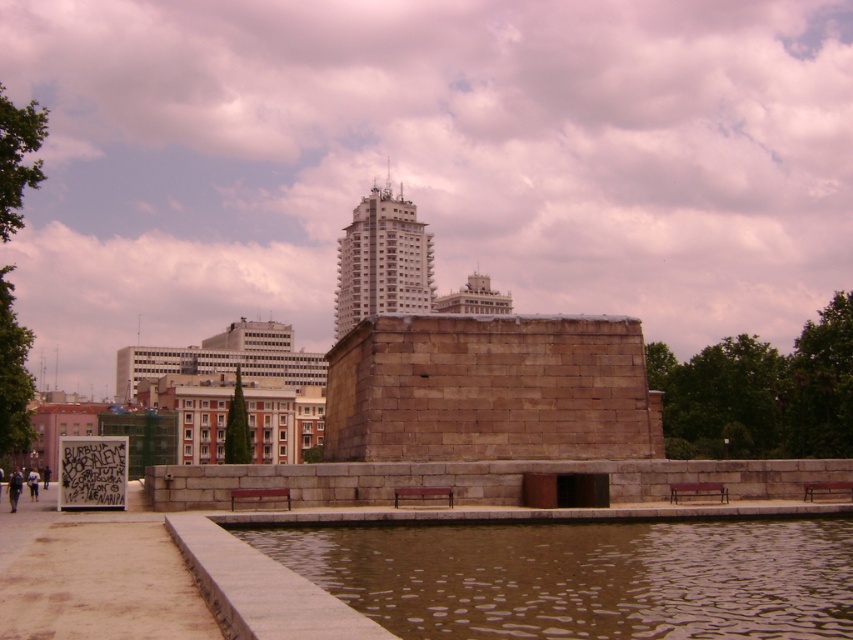
You are standing at the point labeled as point (582,577) in the image. What do you see directly in front of you?

You see brown water at lower center directly in front of you at point (582,577).

Based on the photo, you are standing at the point with coordinates point (312,362) and want to walk towards the point (751,586). Which direction should you move to reach your destination?

You should move forward because point (751,586) is in front of point (312,362).